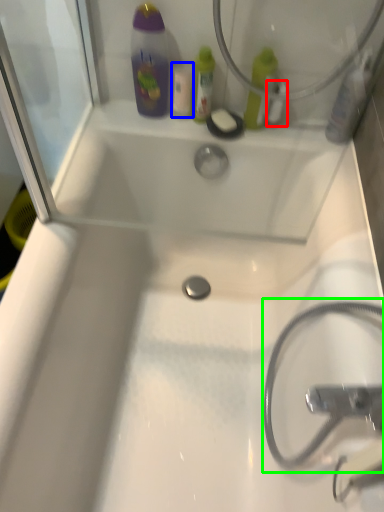
Question: Considering the real-world distances, which object is farthest from mouthwash (highlighted by a red box)? mouthwash (highlighted by a blue box) or garden hose (highlighted by a green box)?

Choices:
 (A) mouthwash
 (B) garden hose

Answer: (B)